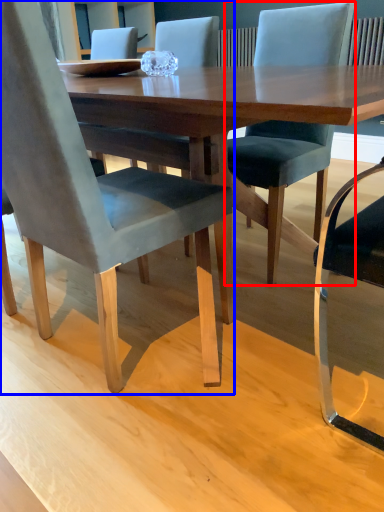
Question: Which point is closer to the camera, chair (highlighted by a red box) or chair (highlighted by a blue box)?

Choices:
 (A) chair
 (B) chair

Answer: (B)